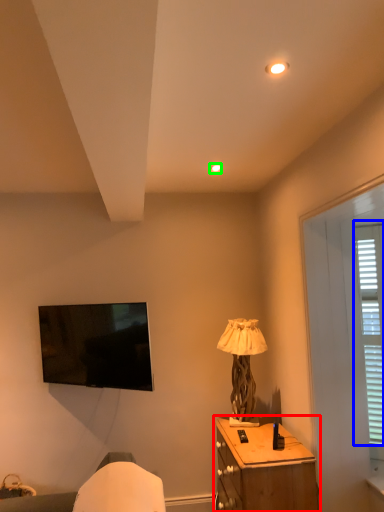
Question: Which object is the farthest from nightstand (highlighted by a red box)? Choose among these: bay window (highlighted by a blue box) or lighting (highlighted by a green box).

Choices:
 (A) bay window
 (B) lighting

Answer: (B)